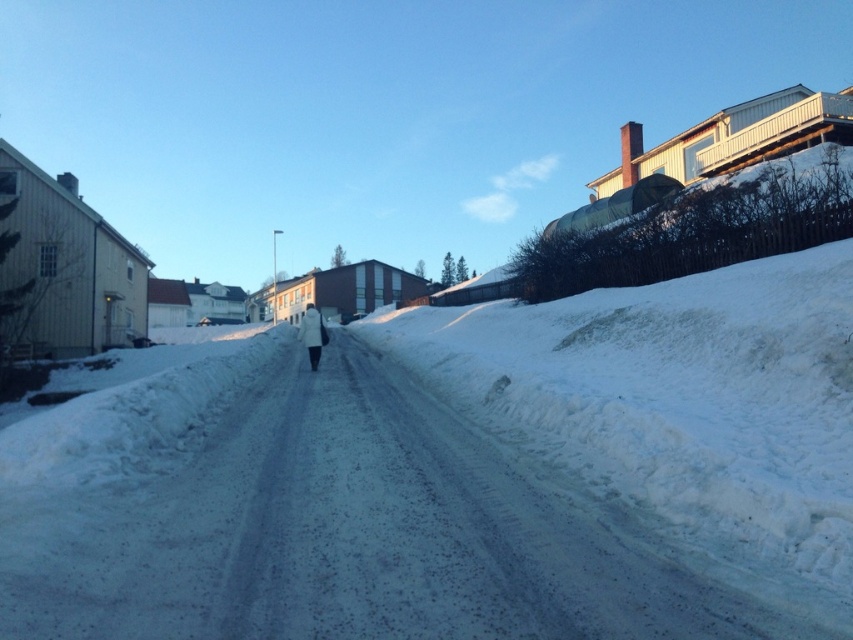
Question: Does white fluffy snow at center have a lesser width compared to white fluffy coat at center?

Choices:
 (A) no
 (B) yes

Answer: (A)

Question: Does white fluffy snow at center lie in front of white fluffy coat at center?

Choices:
 (A) no
 (B) yes

Answer: (B)

Question: Which of the following is the closest to the observer?

Choices:
 (A) (440, 618)
 (B) (312, 333)

Answer: (A)

Question: Is white fluffy snow at center in front of white fluffy coat at center?

Choices:
 (A) yes
 (B) no

Answer: (A)